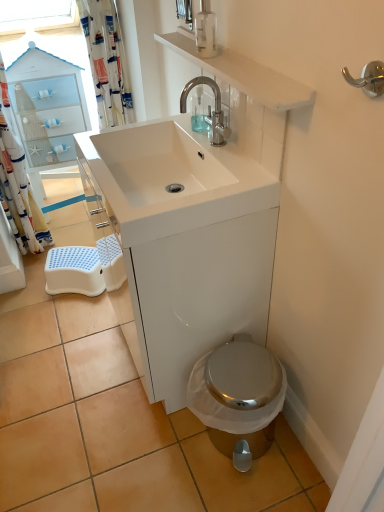
What is the approximate height of white glossy sink at upper center?

2.07 inches.

Find the location of a particular element. The width and height of the screenshot is (384, 512). polished chrome hook at upper right is located at coordinates (368, 78).

Find the location of a particular element. white fabric shower curtain at upper left, the 1th shower curtain positioned from the right is located at coordinates (107, 61).

Where is `white plastic step stool at lower left`? The image size is (384, 512). white plastic step stool at lower left is located at coordinates (74, 271).

In the scene shown: Is white glossy sink at upper center not close to transparent plastic soap dispenser at center, which ranks as the first soap dispenser in bottom-to-top order?

Actually, white glossy sink at upper center and transparent plastic soap dispenser at center, which ranks as the first soap dispenser in bottom-to-top order, are a little close together.

From the image's perspective, does white glossy sink at upper center appear lower than transparent plastic soap dispenser at center, placed as the 2th soap dispenser when sorted from top to bottom?

No.

Do you think white glossy sink at upper center is within transparent plastic soap dispenser at center, which ranks as the first soap dispenser in bottom-to-top order, or outside of it?

white glossy sink at upper center lies outside transparent plastic soap dispenser at center, which ranks as the first soap dispenser in bottom-to-top order.

Considering the sizes of objects white fabric shower curtain at upper left, the 1th shower curtain positioned from the right, and white glossy sink at center in the image provided, who is taller, white fabric shower curtain at upper left, the 1th shower curtain positioned from the right, or white glossy sink at center?

white fabric shower curtain at upper left, the 1th shower curtain positioned from the right.

What's the angular difference between white fabric shower curtain at upper left, arranged as the 2th shower curtain when viewed from the left, and white glossy sink at center's facing directions?

90 degrees.

From a real-world perspective, between white fabric shower curtain at upper left, arranged as the 2th shower curtain when viewed from the left, and white glossy sink at center, who is vertically lower?

In real-world perspective, white glossy sink at center is lower.

Can you see white fabric shower curtain at upper left, the 1th shower curtain positioned from the right, touching white glossy sink at center?

They are not placed beside each other.

From the image's perspective, which is below, transparent plastic soap dispenser at center, which ranks as the first soap dispenser in bottom-to-top order, or white fabric shower curtain at left, which is counted as the 1th shower curtain, starting from the left?

white fabric shower curtain at left, which is counted as the 1th shower curtain, starting from the left, from the image's perspective.

In the scene shown: Is transparent plastic soap dispenser at center, the first soap dispenser when ordered from back to front, behind white fabric shower curtain at left, which is counted as the 1th shower curtain, starting from the left?

No, transparent plastic soap dispenser at center, the first soap dispenser when ordered from back to front, is closer to the camera.

Is white fabric shower curtain at left, the 2th shower curtain viewed from the right, completely or partially inside transparent plastic soap dispenser at center, which ranks as the first soap dispenser in bottom-to-top order?

No, white fabric shower curtain at left, the 2th shower curtain viewed from the right, is not inside transparent plastic soap dispenser at center, which ranks as the first soap dispenser in bottom-to-top order.

Which of these two, white fabric shower curtain at left, the 2th shower curtain viewed from the right, or white fabric shower curtain at upper left, arranged as the 2th shower curtain when viewed from the left, stands shorter?

With less height is white fabric shower curtain at upper left, arranged as the 2th shower curtain when viewed from the left.

Which is correct: white fabric shower curtain at left, which is counted as the 1th shower curtain, starting from the left, is inside white fabric shower curtain at upper left, the 1th shower curtain positioned from the right, or outside of it?

white fabric shower curtain at left, which is counted as the 1th shower curtain, starting from the left, is not enclosed by white fabric shower curtain at upper left, the 1th shower curtain positioned from the right.

From a real-world perspective, which object stands above the other?

white fabric shower curtain at upper left, arranged as the 2th shower curtain when viewed from the left.

In terms of size, does white fabric shower curtain at left, the 2th shower curtain viewed from the right, appear bigger or smaller than white fabric shower curtain at upper left, the 1th shower curtain positioned from the right?

Considering their sizes, white fabric shower curtain at left, the 2th shower curtain viewed from the right, takes up more space than white fabric shower curtain at upper left, the 1th shower curtain positioned from the right.

Which object is further away from the camera taking this photo, polished chrome faucet at upper center or white fabric shower curtain at upper left, arranged as the 2th shower curtain when viewed from the left?

white fabric shower curtain at upper left, arranged as the 2th shower curtain when viewed from the left, is more distant.

Is there a large distance between polished chrome faucet at upper center and white fabric shower curtain at upper left, arranged as the 2th shower curtain when viewed from the left?

Actually, polished chrome faucet at upper center and white fabric shower curtain at upper left, arranged as the 2th shower curtain when viewed from the left, are a little close together.

Based on their sizes in the image, would you say polished chrome faucet at upper center is bigger or smaller than white fabric shower curtain at upper left, arranged as the 2th shower curtain when viewed from the left?

Considering their sizes, polished chrome faucet at upper center takes up less space than white fabric shower curtain at upper left, arranged as the 2th shower curtain when viewed from the left.

Looking at this image, considering the relative sizes of polished chrome faucet at upper center and white fabric shower curtain at upper left, arranged as the 2th shower curtain when viewed from the left, in the image provided, is polished chrome faucet at upper center taller than white fabric shower curtain at upper left, arranged as the 2th shower curtain when viewed from the left,?

Incorrect, the height of polished chrome faucet at upper center is not larger of that of white fabric shower curtain at upper left, arranged as the 2th shower curtain when viewed from the left.

Consider the image. Is white plastic step stool at lower left closer to the viewer compared to polished chrome faucet at upper center?

No.

Is white plastic step stool at lower left in contact with polished chrome faucet at upper center?

No, white plastic step stool at lower left is not beside polished chrome faucet at upper center.

From the image's perspective, which one is positioned higher, white plastic step stool at lower left or polished chrome faucet at upper center?

polished chrome faucet at upper center.

Between white plastic step stool at lower left and polished chrome faucet at upper center, which one has less height?

Standing shorter between the two is white plastic step stool at lower left.

Is polished chrome hook at upper right inside white plastic step stool at lower left?

No, white plastic step stool at lower left does not contain polished chrome hook at upper right.

Can you tell me how much white plastic step stool at lower left and polished chrome hook at upper right differ in facing direction?

61.8 degrees separate the facing orientations of white plastic step stool at lower left and polished chrome hook at upper right.

You are a GUI agent. You are given a task and a screenshot of the screen. Output one action in this format:
    pyautogui.click(x=<x>, y=<y>)
    Task: Click on the step stool that is on the left side of polished chrome hook at upper right
    
    Given the screenshot: What is the action you would take?
    pyautogui.click(x=74, y=271)

Is point (77, 275) positioned behind point (373, 86)?

Yes, it is.

Where is `counter top above the transparent plastic soap dispenser at center, placed as the 2th soap dispenser when sorted from top to bottom (from the image's perspective)`? This screenshot has height=512, width=384. counter top above the transparent plastic soap dispenser at center, placed as the 2th soap dispenser when sorted from top to bottom (from the image's perspective) is located at coordinates (243, 74).

Identify the location of shower curtain that appears above the white glossy sink at center (from a real-world perspective). Image resolution: width=384 pixels, height=512 pixels. (107, 61).

Looking at the image, which one is located further to white fabric shower curtain at upper left, the 1th shower curtain positioned from the right, polished chrome hook at upper right or white glossy sink at center?

polished chrome hook at upper right is further to white fabric shower curtain at upper left, the 1th shower curtain positioned from the right.

Estimate the real-world distances between objects in this image. Which object is further from clear glass soap dispenser at upper center, the 1th soap dispenser in the top-to-bottom sequence, polished chrome faucet at upper center or white glossy sink at upper center?

polished chrome faucet at upper center.

From the image, which object appears to be nearer to polished chrome faucet at upper center, polished chrome hook at upper right or white fabric shower curtain at upper left, arranged as the 2th shower curtain when viewed from the left?

Based on the image, white fabric shower curtain at upper left, arranged as the 2th shower curtain when viewed from the left, appears to be nearer to polished chrome faucet at upper center.

Based on their spatial positions, is white glossy sink at center or transparent plastic soap dispenser at center, which ranks as the first soap dispenser in bottom-to-top order, further from polished chrome hook at upper right?

Based on the image, transparent plastic soap dispenser at center, which ranks as the first soap dispenser in bottom-to-top order, appears to be further to polished chrome hook at upper right.

Which object lies further to the anchor point polished chrome faucet at upper center, white glossy sink at upper center or white fabric shower curtain at upper left, the 1th shower curtain positioned from the right?

white fabric shower curtain at upper left, the 1th shower curtain positioned from the right, is positioned further to the anchor polished chrome faucet at upper center.

Based on their spatial positions, is transparent plastic soap dispenser at center, placed as the 2th soap dispenser when sorted from top to bottom, or polished chrome faucet at upper center further from white glossy sink at center?

transparent plastic soap dispenser at center, placed as the 2th soap dispenser when sorted from top to bottom, is further to white glossy sink at center.

Considering their positions, is white glossy sink at upper center positioned further to clear glass soap dispenser at upper center, which appears as the second soap dispenser when ordered from the bottom, than white glossy sink at center?

white glossy sink at center is positioned further to the anchor clear glass soap dispenser at upper center, which appears as the second soap dispenser when ordered from the bottom.

Looking at the image, which one is located closer to clear glass soap dispenser at upper center, positioned as the 2th soap dispenser in back-to-front order, white fabric shower curtain at upper left, arranged as the 2th shower curtain when viewed from the left, or white glossy sink at center?

Based on the image, white glossy sink at center appears to be nearer to clear glass soap dispenser at upper center, positioned as the 2th soap dispenser in back-to-front order.

In order to click on soap dispenser between polished chrome hook at upper right and polished chrome faucet at upper center in the front-back direction in this screenshot , I will do `click(205, 30)`.

This screenshot has width=384, height=512. I want to click on soap dispenser situated between white fabric shower curtain at left, which is counted as the 1th shower curtain, starting from the left, and polished chrome faucet at upper center from left to right, so click(198, 113).

You are a GUI agent. You are given a task and a screenshot of the screen. Output one action in this format:
    pyautogui.click(x=<x>, y=<y>)
    Task: Click on the counter top between white glossy sink at center and polished chrome hook at upper right from left to right
    
    Given the screenshot: What is the action you would take?
    pos(243,74)

Find the location of a particular element. The image size is (384, 512). soap dispenser positioned between clear glass soap dispenser at upper center, which appears as the second soap dispenser when ordered from the bottom, and white plastic step stool at lower left from near to far is located at coordinates (198, 113).